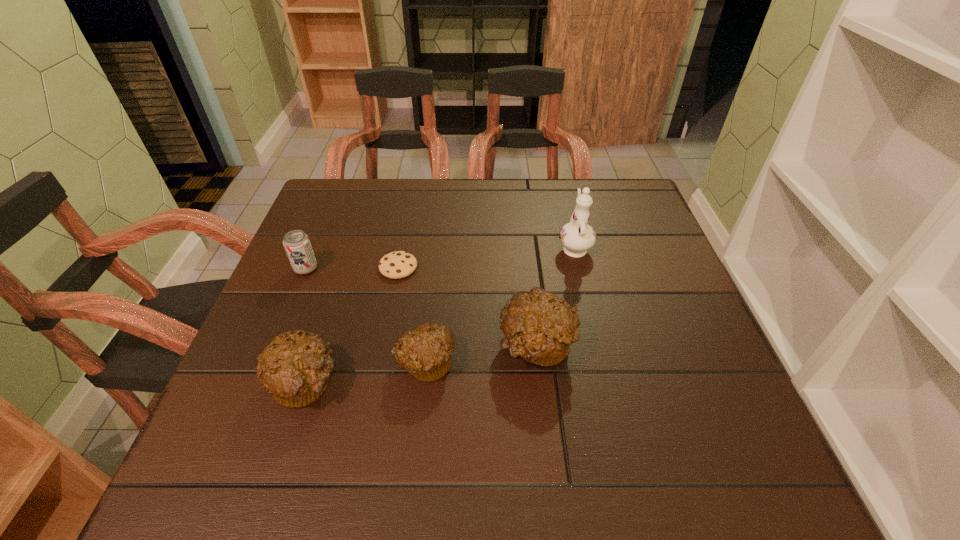
In the image, there is a desktop. Identify the location of vacant area at the near edge. Image resolution: width=960 pixels, height=540 pixels. (535, 409).

What are the coordinates of `vacant space at the left edge` in the screenshot? It's located at (315, 292).

Identify the location of free space at the right edge of the desktop. The image size is (960, 540). (655, 278).

I want to click on vacant space at the far left corner of the desktop, so click(346, 226).

Locate an element on the screen. The image size is (960, 540). vacant space at the far right corner of the desktop is located at coordinates click(634, 180).

This screenshot has height=540, width=960. What are the coordinates of `unoccupied position between the shortest object and the beer can` in the screenshot? It's located at (352, 268).

Locate an element on the screen. The width and height of the screenshot is (960, 540). vacant space that is in between the rightmost muffin and the fifth tallest object is located at coordinates (481, 354).

Locate an element on the screen. The height and width of the screenshot is (540, 960). unoccupied area between the beer can and the rightmost muffin is located at coordinates (421, 307).

Where is `vacant space that's between the beer can and the rightmost muffin`? This screenshot has height=540, width=960. vacant space that's between the beer can and the rightmost muffin is located at coordinates (421, 307).

The width and height of the screenshot is (960, 540). What are the coordinates of `free spot between the second shortest muffin and the beer can` in the screenshot? It's located at (305, 325).